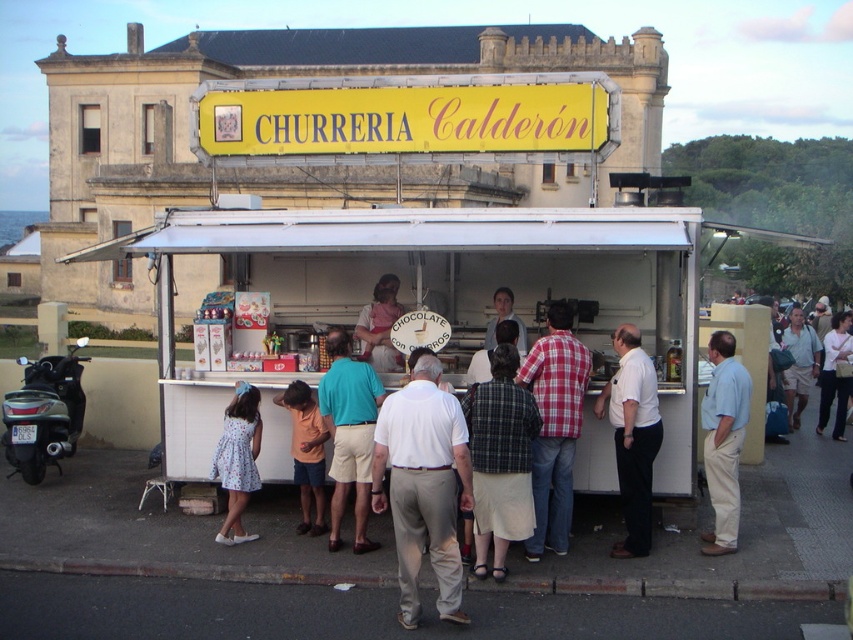
Question: Does plaid fabric jacket at center come in front of khaki cotton shorts at center?

Choices:
 (A) yes
 (B) no

Answer: (A)

Question: Does plaid fabric jacket at center appear under white shirt at center?

Choices:
 (A) yes
 (B) no

Answer: (A)

Question: Considering the relative positions of teal fabric shirt at center and floral dress at center in the image provided, where is teal fabric shirt at center located with respect to floral dress at center?

Choices:
 (A) left
 (B) right

Answer: (B)

Question: Based on their relative distances, which object is farther from the teal fabric shirt at center?

Choices:
 (A) plaid fabric jacket at center
 (B) white shirt at center
 (C) white cotton shirt at center

Answer: (C)

Question: Which object is closer to the camera taking this photo?

Choices:
 (A) white cotton shirt at center
 (B) plaid fabric jacket at center
 (C) khaki cotton shorts at center

Answer: (B)

Question: Which object appears closest to the camera in this image?

Choices:
 (A) floral dress at center
 (B) white shirt at center

Answer: (B)